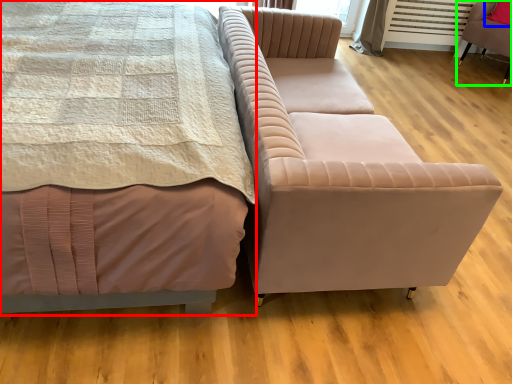
Question: Which object is positioned farthest from bed (highlighted by a red box)? Select from pillow (highlighted by a blue box) and chair (highlighted by a green box).

Choices:
 (A) pillow
 (B) chair

Answer: (A)